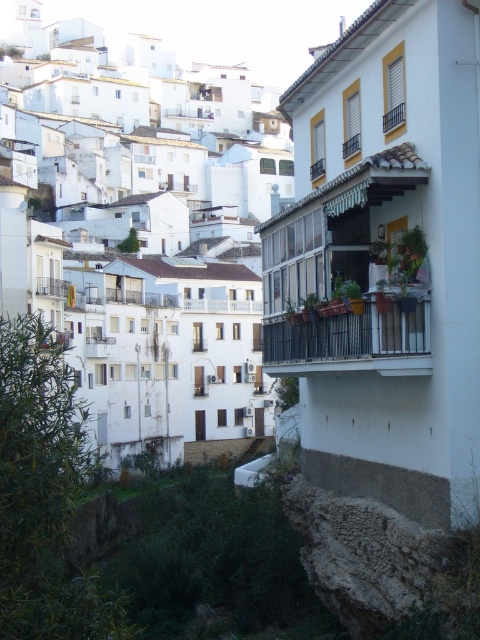
You are standing at the base of the hillside town and looking up. There are two white wooden balconies in your view. The first is the white wooden balcony at center, and the second is the white wooden balcony at upper center. Which balcony is higher up the hill?

The white wooden balcony at upper center is higher up the hill because it is positioned above the white wooden balcony at center.

You are standing on the lower part of the hillside town and looking up towards the buildings. Which balcony, the black metal balcony at center or the white wooden balcony at center, is closer to you?

The black metal balcony at center is closer to you because it is positioned under the white wooden balcony at center, meaning it is lower down the slope.